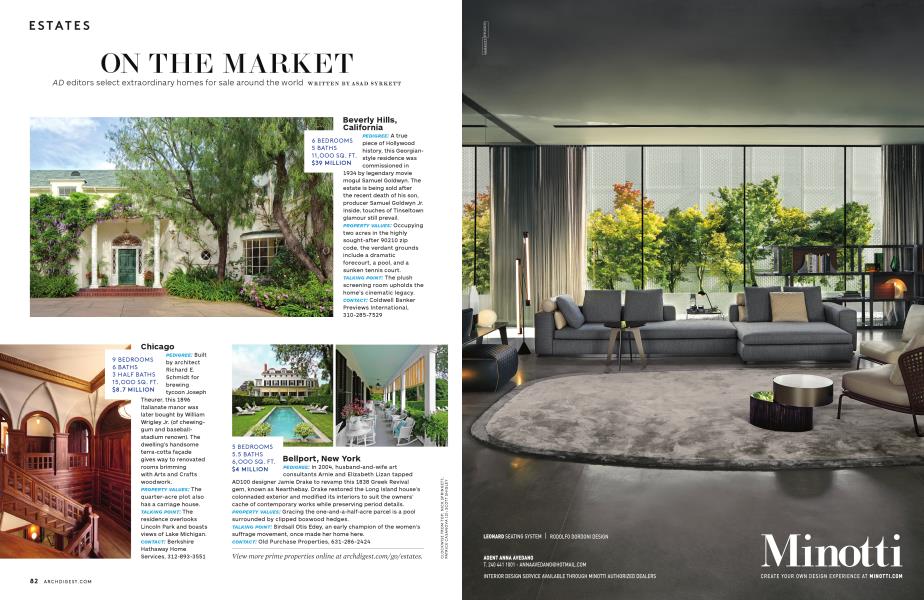
In order to click on lounge/couch in this screenshot , I will do `click(687, 332)`.